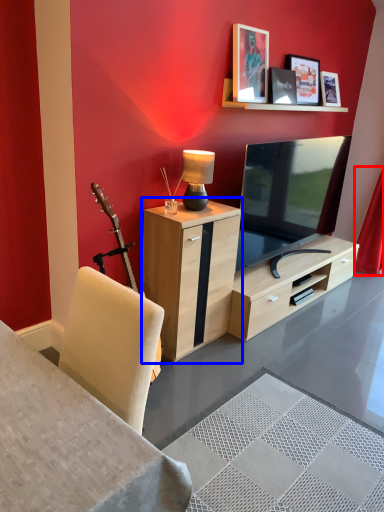
Question: Which object appears farthest to the camera in this image, curtain (highlighted by a red box) or cabinetry (highlighted by a blue box)?

Choices:
 (A) curtain
 (B) cabinetry

Answer: (A)